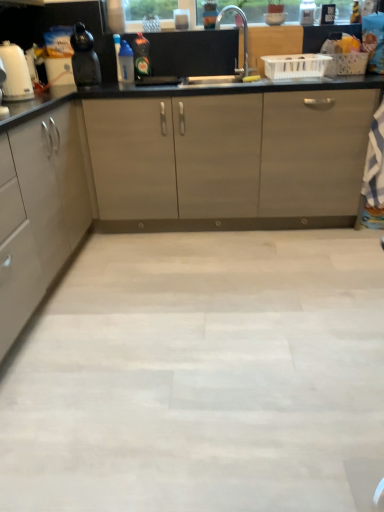
Identify the location of free area below silver metallic faucet at upper center (from a real-world perspective). This screenshot has width=384, height=512. pyautogui.click(x=231, y=77).